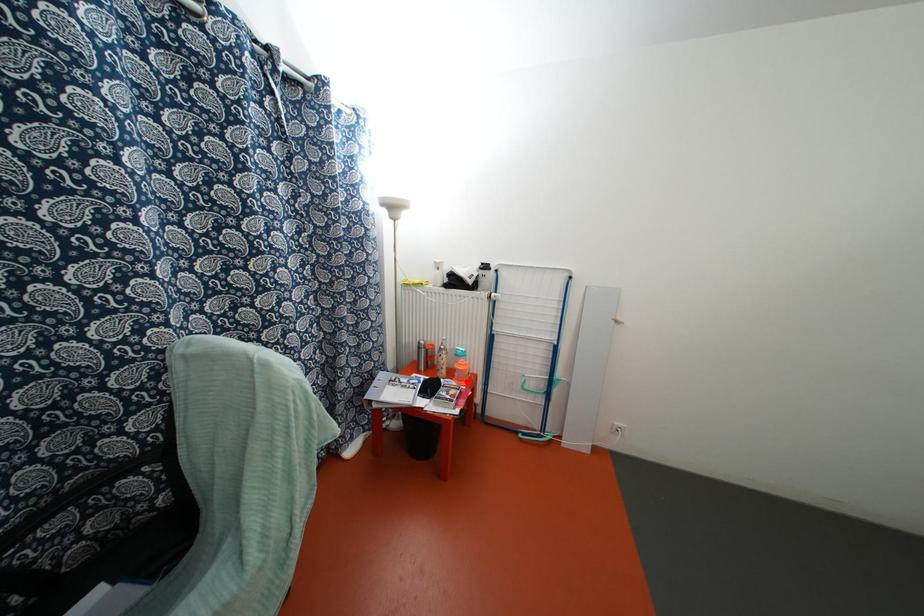
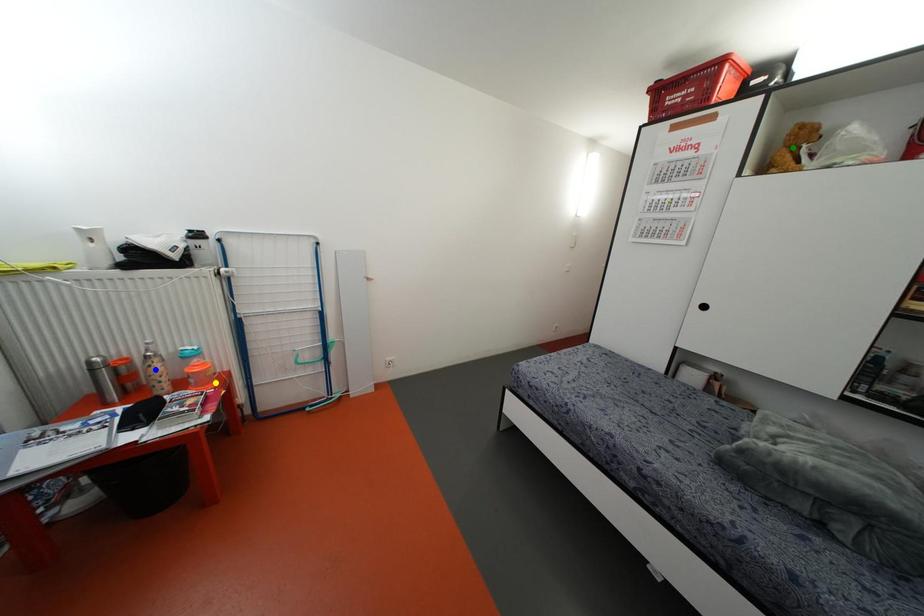
Question: I am providing you with two images of the same scene from different viewpoints. A red point is marked on the first image. You are given multiple points on the second image. Which point in image 2 represents the same 3d spot as the red point in image 1?

Choices:
 (A) green point
 (B) blue point
 (C) yellow point

Answer: (C)